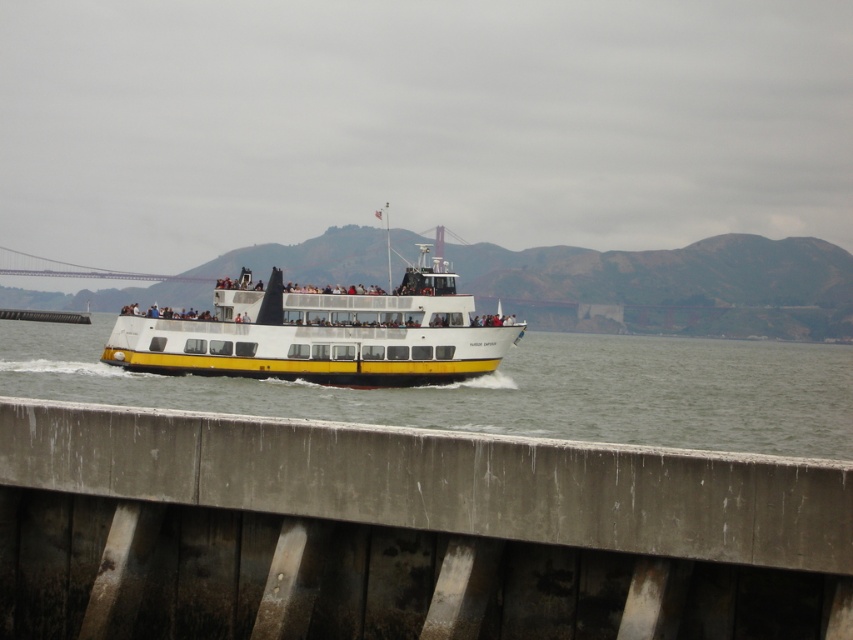
Question: Estimate the real-world distances between objects in this image. Which object is closer to the white/yellow ferry at center?

Choices:
 (A) metallic gray bridge at center
 (B) white matte water at center

Answer: (B)

Question: Is white matte water at center in front of white/yellow ferry at center?

Choices:
 (A) yes
 (B) no

Answer: (A)

Question: Estimate the real-world distances between objects in this image. Which object is farther from the white matte water at center?

Choices:
 (A) white/yellow ferry at center
 (B) metallic gray bridge at center

Answer: (B)

Question: Which point is farther to the camera?

Choices:
 (A) metallic gray bridge at center
 (B) white matte water at center
 (C) white/yellow ferry at center

Answer: (C)

Question: Does metallic gray bridge at center appear on the right side of white/yellow ferry at center?

Choices:
 (A) no
 (B) yes

Answer: (B)

Question: Observing the image, what is the correct spatial positioning of metallic gray bridge at center in reference to white/yellow ferry at center?

Choices:
 (A) above
 (B) below

Answer: (B)